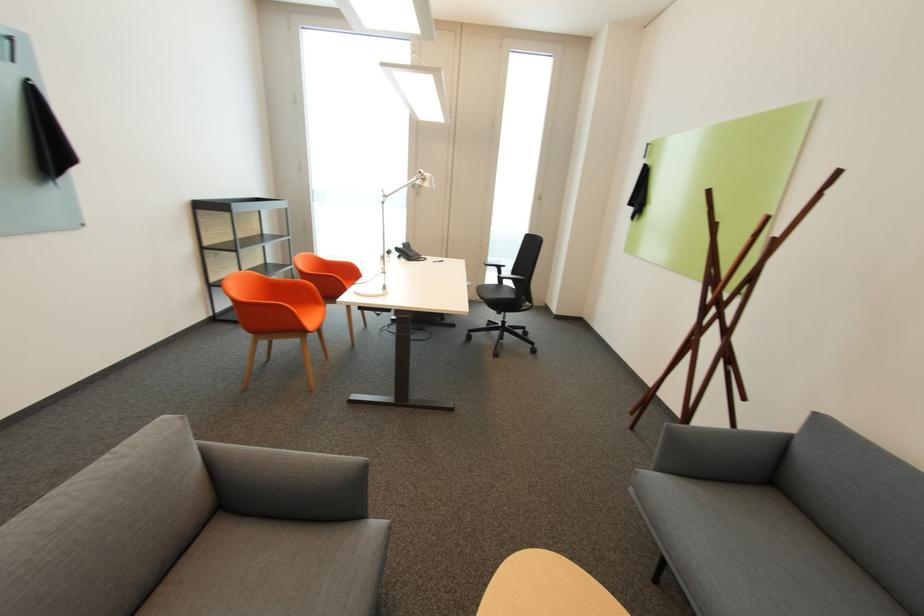
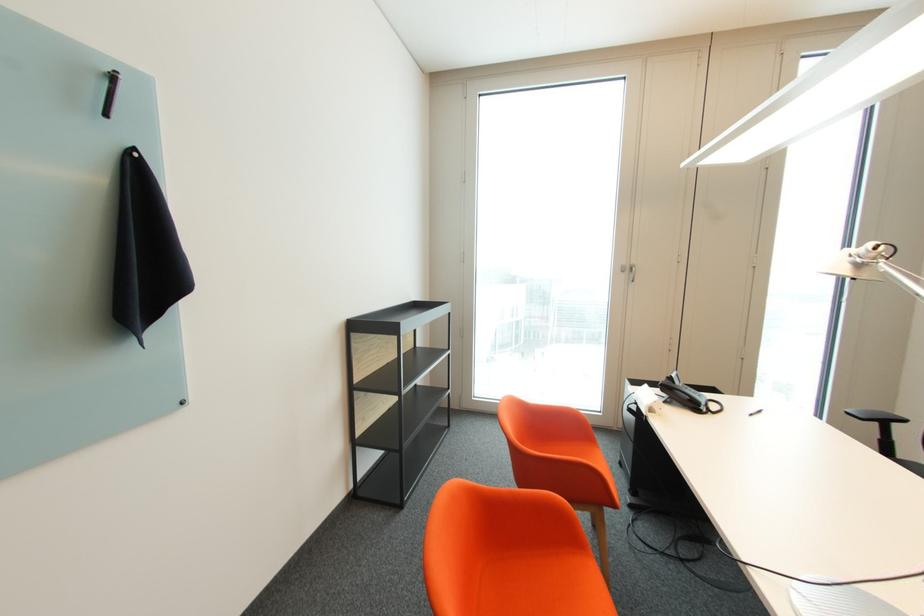
The point at [406,254] is marked in the first image. Where is the corresponding point in the second image?

(673, 397)